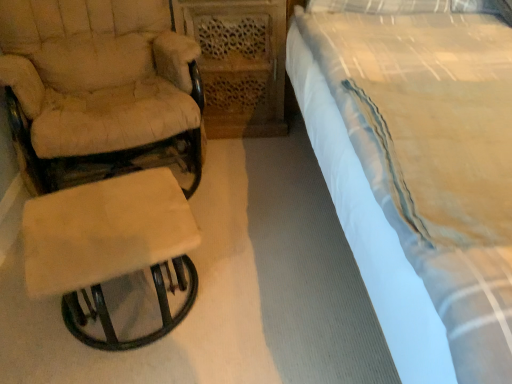
This screenshot has width=512, height=384. In order to click on vacant space in beige fabric stool at left (from a real-world perspective) in this screenshot , I will do `click(133, 311)`.